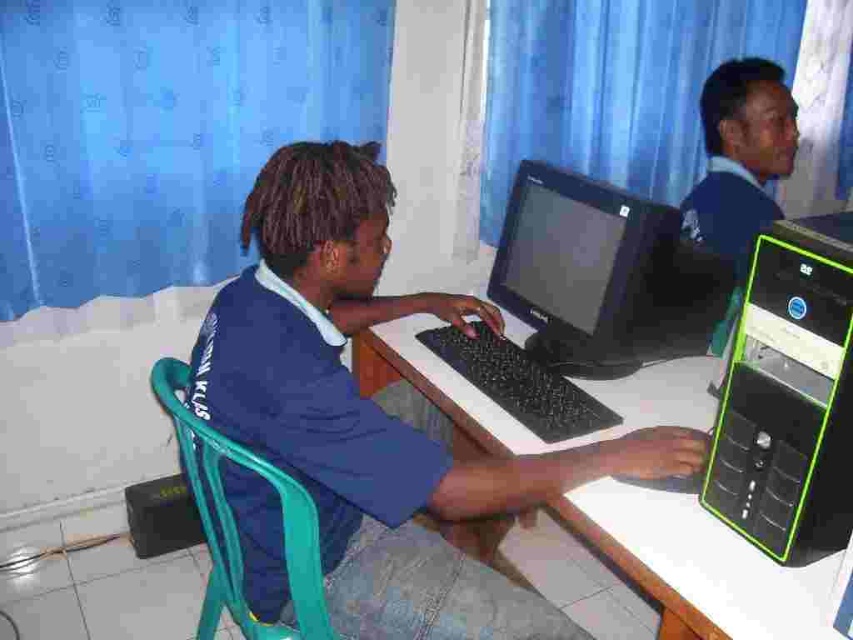
Question: Which is farther from the black plastic monitor at center?

Choices:
 (A) matte black laptop at upper right
 (B) blue fabric shirt at center
 (C) black plastic keyboard at center
 (D) black plastic computer at center

Answer: (D)

Question: Estimate the real-world distances between objects in this image. Which object is closer to the white plastic table at center?

Choices:
 (A) matte black laptop at upper right
 (B) black plastic computer at center
 (C) black plastic monitor at center
 (D) blue fabric shirt at center

Answer: (C)

Question: Is blue fabric shirt at center wider than black plastic computer at center?

Choices:
 (A) no
 (B) yes

Answer: (B)

Question: Can you confirm if blue fabric shirt at center is wider than black plastic computer at center?

Choices:
 (A) no
 (B) yes

Answer: (B)

Question: Can you confirm if black plastic monitor at center is positioned to the right of black plastic keyboard at center?

Choices:
 (A) no
 (B) yes

Answer: (B)

Question: Which object appears farthest from the camera in this image?

Choices:
 (A) black plastic computer at center
 (B) black plastic monitor at center
 (C) black plastic keyboard at center
 (D) blue fabric shirt at center

Answer: (B)